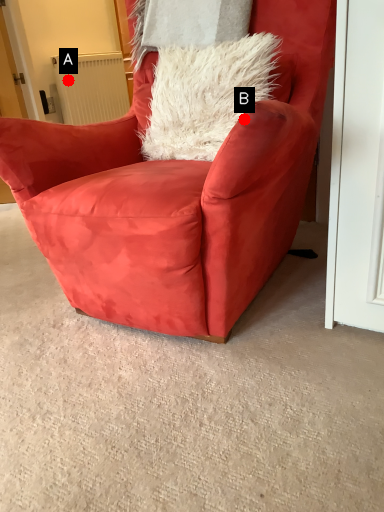
Question: Two points are circled on the image, labeled by A and B beside each circle. Which point is closer to the camera?

Choices:
 (A) A is closer
 (B) B is closer

Answer: (B)